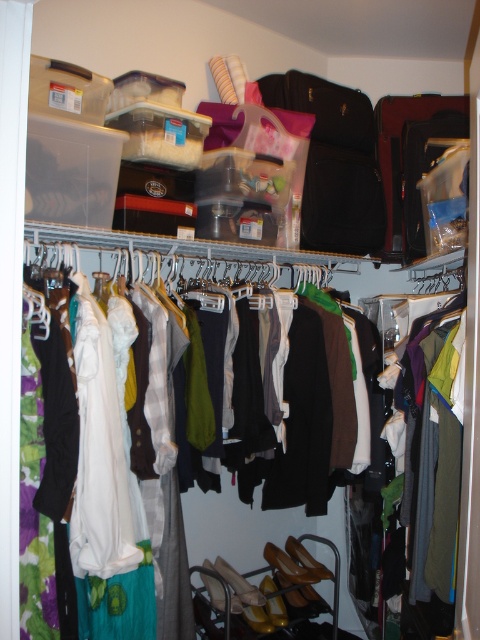
Question: Estimate the real-world distances between objects in this image. Which object is farther from the black leather suitcase at upper right?

Choices:
 (A) matte black suitcase at center
 (B) white plastic hanger at center

Answer: (B)

Question: Which point is closer to the camera?

Choices:
 (A) matte black suitcase at center
 (B) black leather suitcase at upper right

Answer: (B)

Question: Does black leather suitcase at upper right have a lesser width compared to matte black suitcase at center?

Choices:
 (A) yes
 (B) no

Answer: (B)

Question: Which point is farther to the camera?

Choices:
 (A) matte black suitcase at center
 (B) black leather suitcase at upper right

Answer: (A)

Question: Can you confirm if white plastic hanger at center is wider than matte black suitcase at center?

Choices:
 (A) no
 (B) yes

Answer: (B)

Question: Does black leather suitcase at upper right appear under white plastic hanger at center?

Choices:
 (A) yes
 (B) no

Answer: (B)